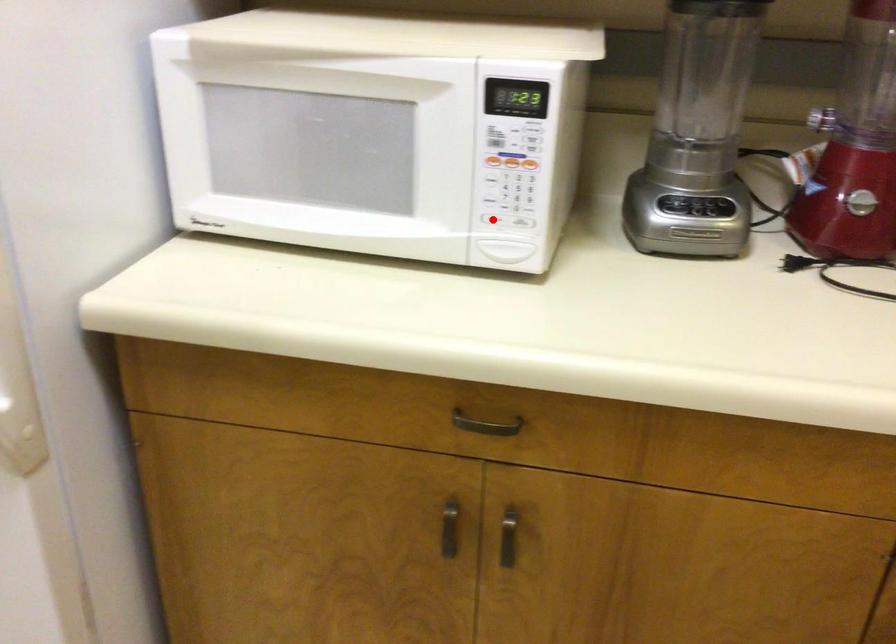
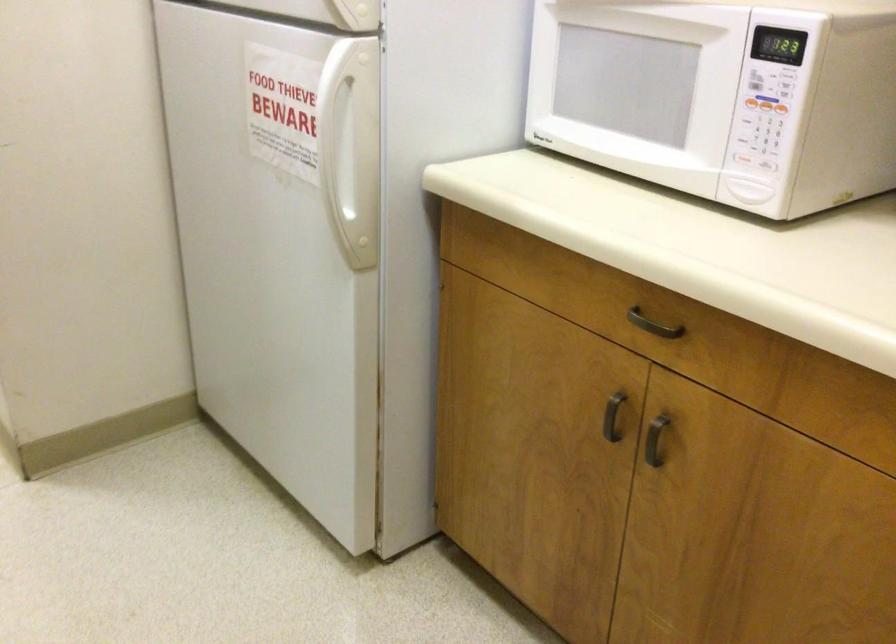
Locate, in the second image, the point that corresponds to the highlighted location in the first image.

(741, 158)